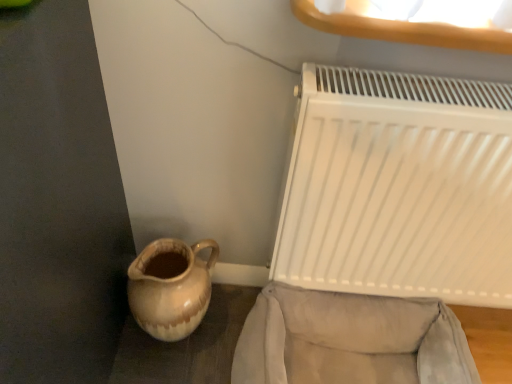
The width and height of the screenshot is (512, 384). I want to click on vacant region to the right of brown glazed jug at lower left, so click(230, 322).